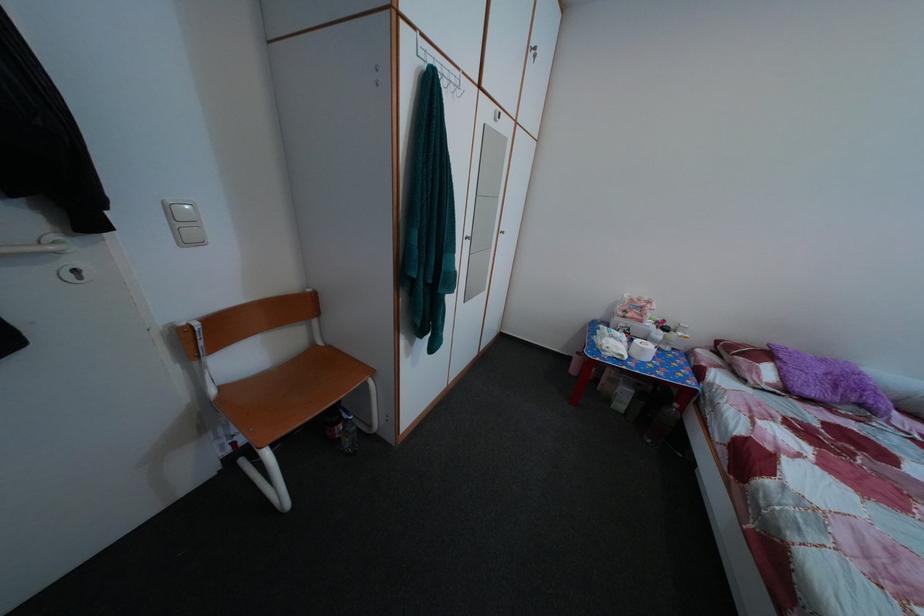
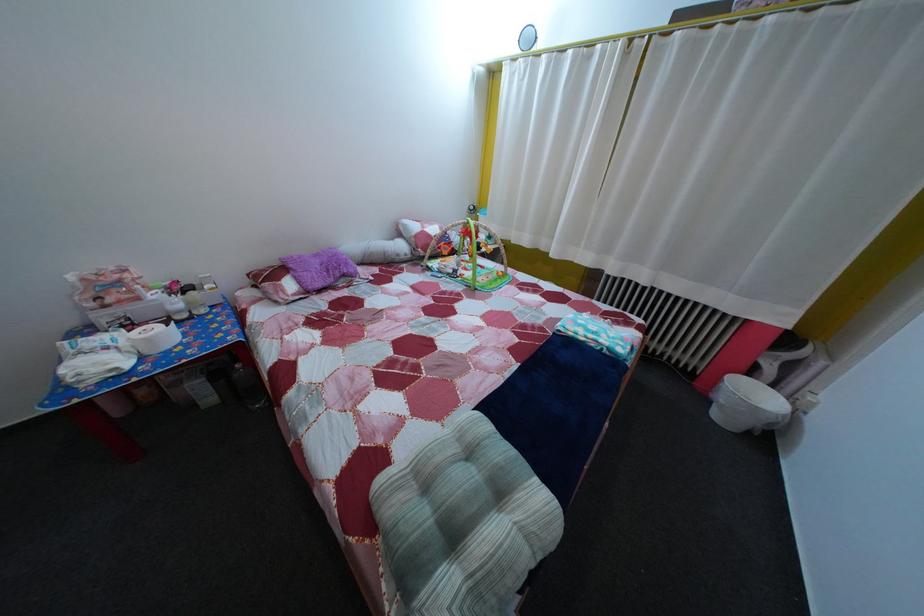
Locate, in the second image, the point that corresponds to point (652, 358) in the first image.

(157, 347)